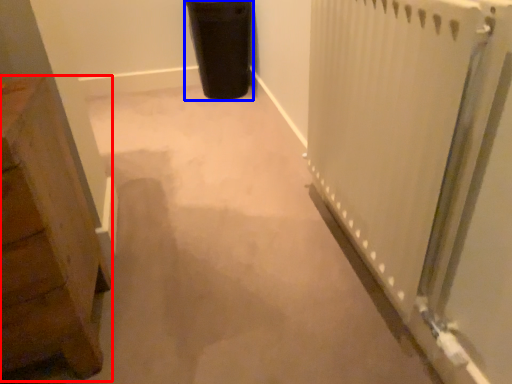
Question: Which point is further to the camera, furniture (highlighted by a red box) or garbage (highlighted by a blue box)?

Choices:
 (A) furniture
 (B) garbage

Answer: (B)